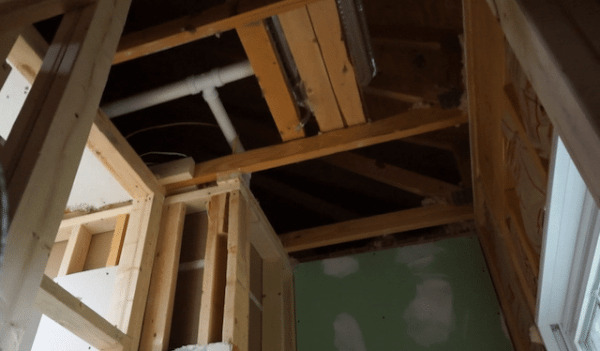
You are a GUI agent. You are given a task and a screenshot of the screen. Output one action in this format:
    pyautogui.click(x=<x>, y=<y>)
    Task: Click on the light through window
    The image size is (600, 351).
    Given the screenshot: What is the action you would take?
    pyautogui.click(x=592, y=330)